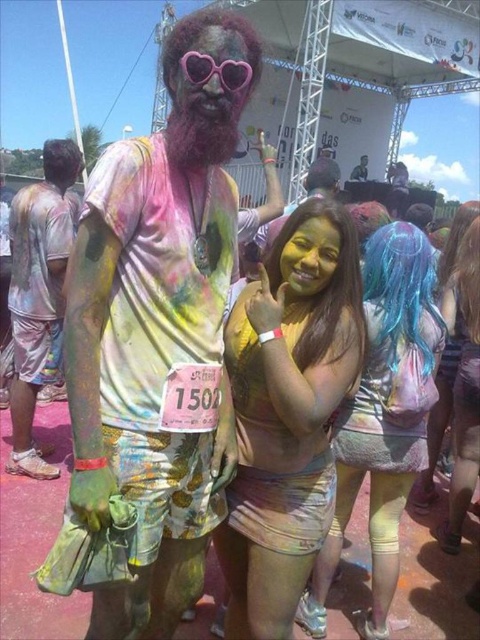
You are a photographer positioned at the edge of the event area. You want to capture a photo of the person in the matte yellow dress at center while ensuring the person on the left wearing a white t shirt splattered with multiple colors is also in the frame. Can you fit both subjects into the shot if your camera has a 1.8 meter wide field of view?

The two subjects are 1.92 meters apart, which is slightly wider than the camera s 1.8 meter field of view. Therefore, it would be challenging to fit both into the same frame without cropping one of them out.

Consider the image. You are at the festival and want to take a photo of both the point at position (295,387) and the point at position (384,632). Which point should you focus on first to ensure both are in the frame?

You should focus on point (295,387) first because it is closer to you than point (384,632), allowing both points to be in the frame.

You are a photographer at the event and need to position a spotlight exactly at the center of the multicolored painted shirt at center. According to the coordinates provided, where should you aim the spotlight?

The spotlight should be aimed at the coordinates point (158, 333) where the multicolored painted shirt at center is located.